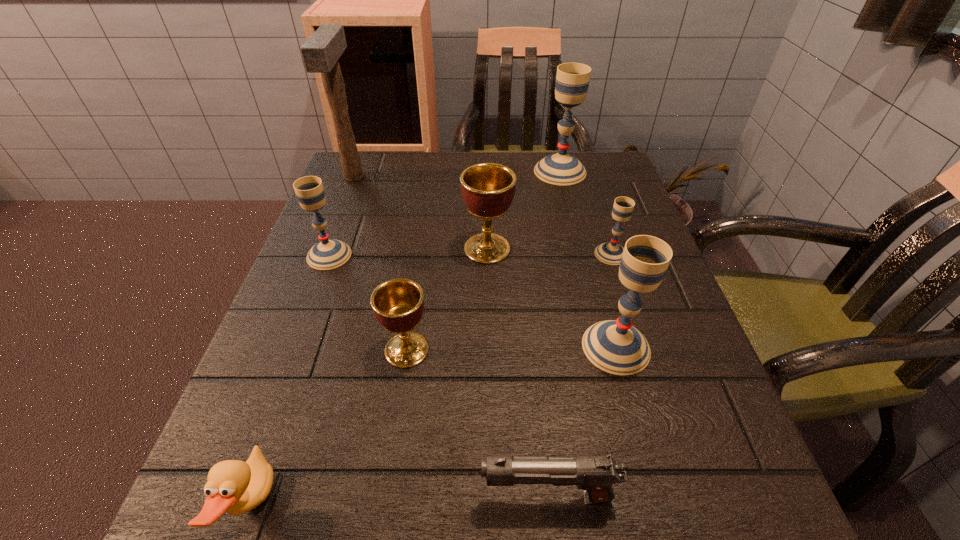
At what (x,y) coordinates should I click in order to perform the action: click on vacant space located in the direction the gray gun is aimed. Please return your answer as a coordinate pair (x, y). The width and height of the screenshot is (960, 540). Looking at the image, I should click on (341, 497).

What are the coordinates of `free point located in the direction the gray gun is aimed` in the screenshot? It's located at 289,497.

This screenshot has height=540, width=960. I want to click on blank area located in the direction the gray gun is aimed, so click(437, 497).

This screenshot has height=540, width=960. Identify the location of mallet that is at the far edge. (320, 53).

Where is `chalice that is at the far edge`? Image resolution: width=960 pixels, height=540 pixels. chalice that is at the far edge is located at coordinates (572, 79).

Where is `object that is at the near edge`? object that is at the near edge is located at coordinates (595, 475).

Locate an element on the screen. mallet at the left edge is located at coordinates (320, 53).

Find the location of a particular element. The width and height of the screenshot is (960, 540). chalice that is at the left edge is located at coordinates (327, 254).

What are the coordinates of `object at the far left corner` in the screenshot? It's located at (320, 53).

At what (x,y) coordinates should I click in order to perform the action: click on object that is positioned at the far right corner. Please return your answer as a coordinate pair (x, y). This screenshot has width=960, height=540. Looking at the image, I should click on (572, 79).